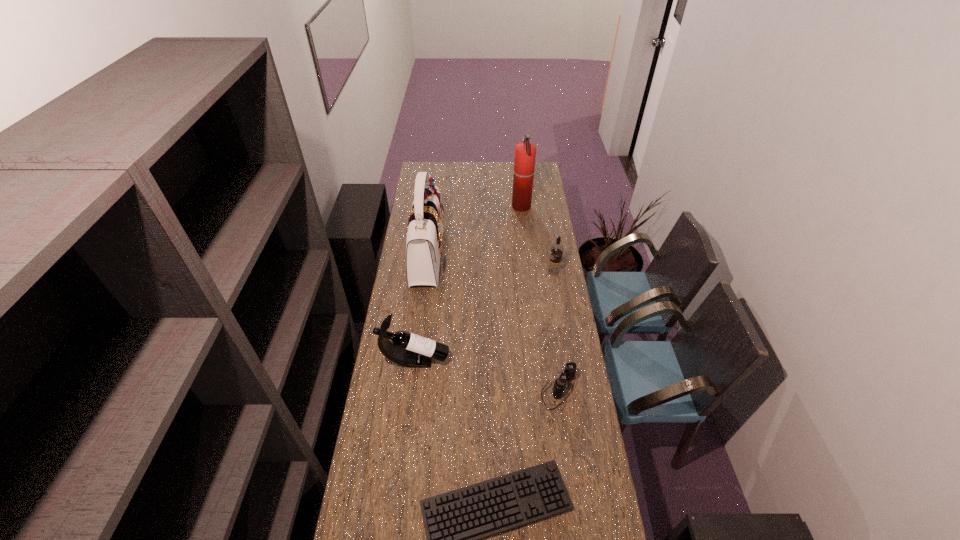
Find the location of a particular element. vacant area between the fifth farthest object and the satchel is located at coordinates (493, 323).

Locate an element on the screen. The width and height of the screenshot is (960, 540). free spot between the fire extinguisher and the fourth tallest object is located at coordinates (538, 239).

Locate an element on the screen. The width and height of the screenshot is (960, 540). vacant area that lies between the vodka and the fifth tallest object is located at coordinates (556, 331).

Locate an element on the screen. Image resolution: width=960 pixels, height=540 pixels. vacant space in between the second nearest object and the vodka is located at coordinates (556, 331).

Find the location of a particular element. object that is the third nearest to the farthest object is located at coordinates (410, 350).

Identify the location of object that is the third closest to the fourth tallest object. (569, 372).

Find the location of a particular element. Image resolution: width=960 pixels, height=540 pixels. free location that satisfies the following two spatial constraints: 1. with the nozzle and gauge on the farthest object; 2. on the left side of the second shortest object is located at coordinates (541, 390).

What are the coordinates of `vacant region that satisfies the following two spatial constraints: 1. on the label of the vodka; 2. on the front side of the fifth farthest object` in the screenshot? It's located at (573, 390).

Where is `vacant space that satisfies the following two spatial constraints: 1. on the label of the fourth tallest object; 2. on the front side of the second shortest object`? The width and height of the screenshot is (960, 540). vacant space that satisfies the following two spatial constraints: 1. on the label of the fourth tallest object; 2. on the front side of the second shortest object is located at coordinates (573, 390).

Identify the location of free space that satisfies the following two spatial constraints: 1. on the front-facing side of the satchel; 2. on the left side of the fifth tallest object. The height and width of the screenshot is (540, 960). (411, 390).